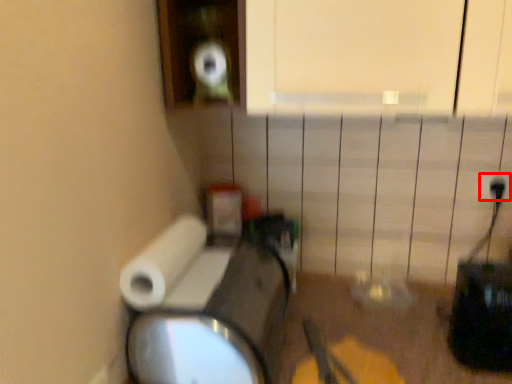
Question: Observing the image, what is the correct spatial positioning of electric outlet (annotated by the red box) in reference to toilet paper?

Choices:
 (A) right
 (B) left

Answer: (A)